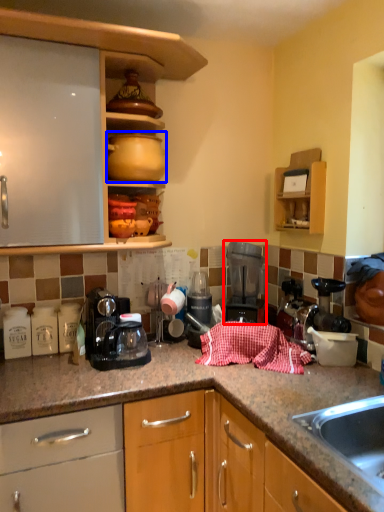
Question: Which of the following is the farthest to the observer, kitchen appliance (highlighted by a red box) or appliance (highlighted by a blue box)?

Choices:
 (A) kitchen appliance
 (B) appliance

Answer: (A)